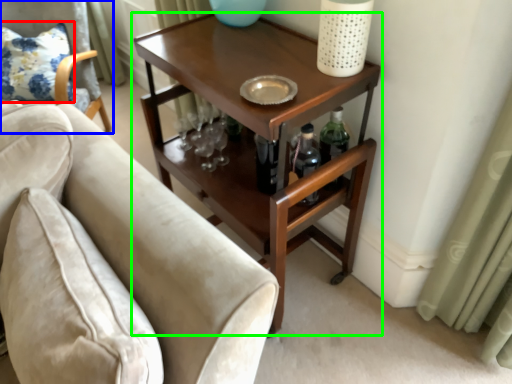
Question: Which object is the farthest from pillow (highlighted by a red box)? Choose among these: chair (highlighted by a blue box) or table (highlighted by a green box).

Choices:
 (A) chair
 (B) table

Answer: (B)